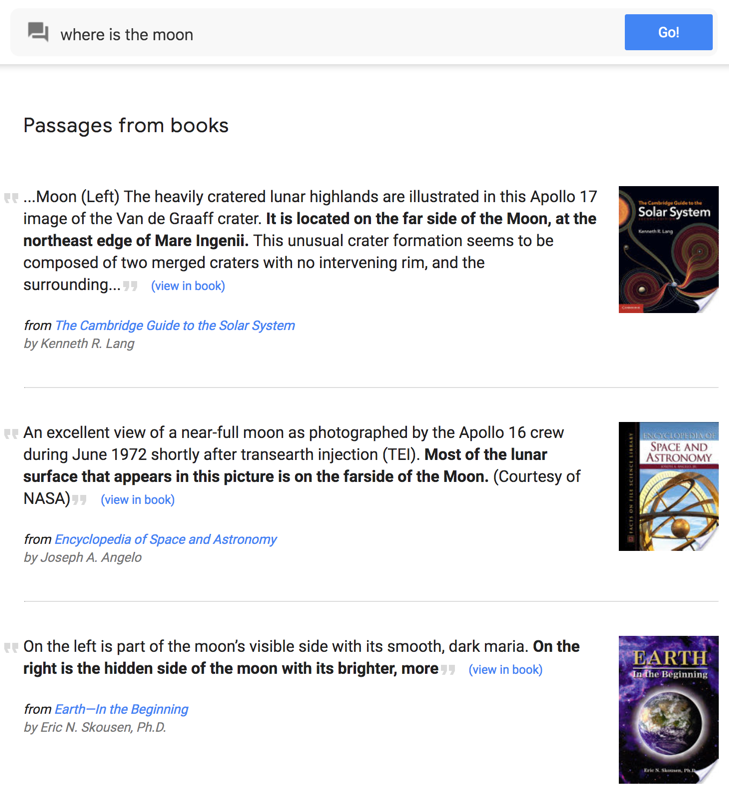
Locate an element on the screen. This screenshot has width=729, height=793. purple book cover is located at coordinates (631, 688).